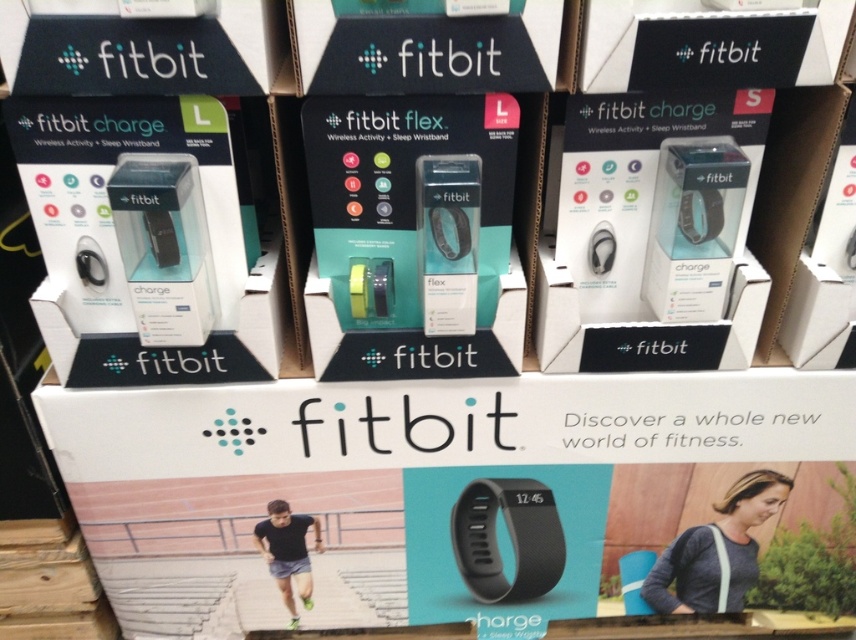
You are a customer looking to purchase a Fitbit Charge. You notice the white matte box at center and the gray fabric purse at lower right in the display. Which item is positioned higher in the image?

The white matte box at center is located above the gray fabric purse at lower right, so it is positioned higher in the image.

You are a customer at the store looking at the Fitbit Charge and Fitbit Flex displays. You see a black matte wristband at center and a gray fabric purse at lower right. Which object is closer to you?

The black matte wristband at center is closer to you because it is in front of the gray fabric purse at lower right.